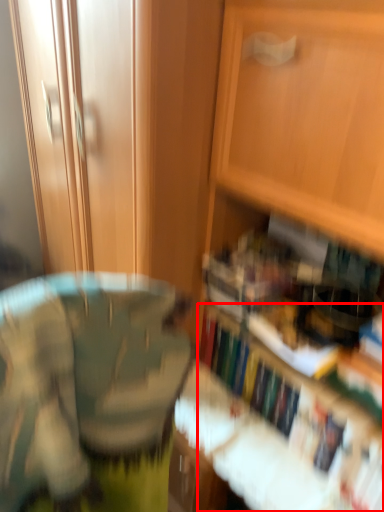
Question: From the image's perspective, what is the correct spatial relationship of book (annotated by the red box) in relation to cabinetry?

Choices:
 (A) above
 (B) below

Answer: (B)